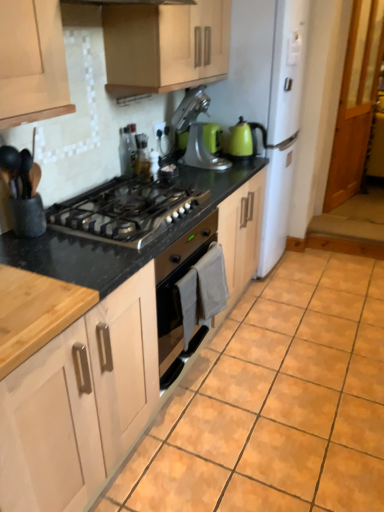
Where is `free location above natural wood countertop at lower left (from a real-world perspective)`? The width and height of the screenshot is (384, 512). free location above natural wood countertop at lower left (from a real-world perspective) is located at coordinates (22, 301).